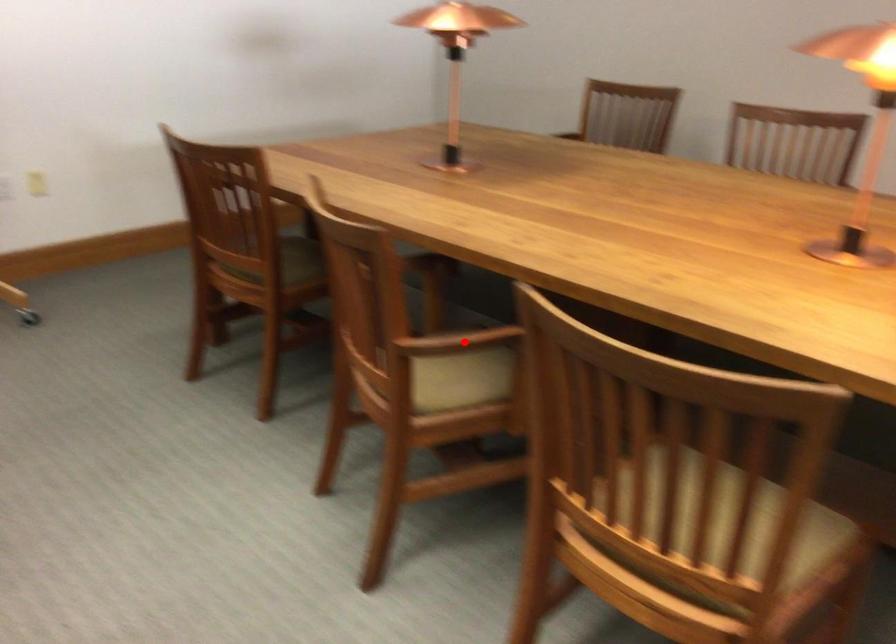
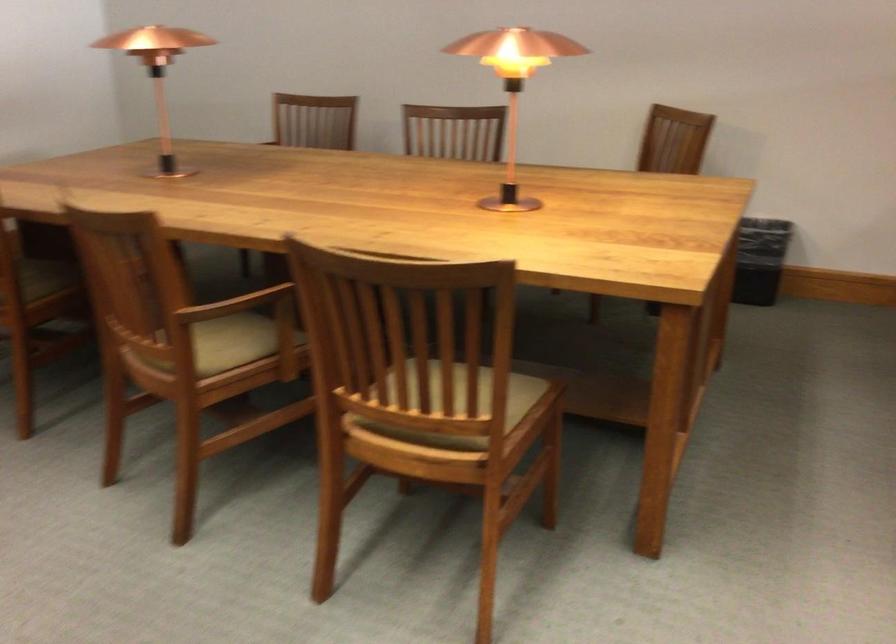
Question: I am providing you with two images of the same scene from different viewpoints. Given a red point in image1, look at the same physical point in image2. Is it:

Choices:
 (A) Closer to the viewpoint
 (B) Farther from the viewpoint

Answer: (B)